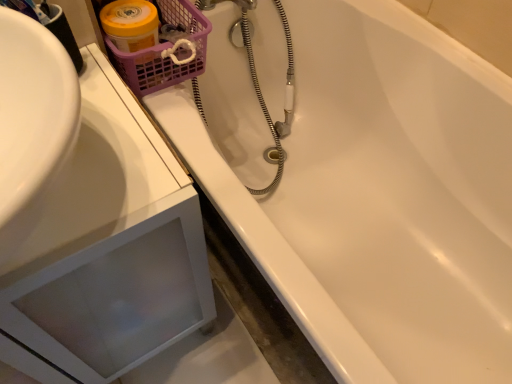
The width and height of the screenshot is (512, 384). What do you see at coordinates (160, 52) in the screenshot?
I see `purple plastic basket at upper left` at bounding box center [160, 52].

Measure the distance between point (x=154, y=84) and camera.

→ Point (x=154, y=84) is 86.60 centimeters away from camera.

Where is `purple plastic basket at upper left`? This screenshot has width=512, height=384. purple plastic basket at upper left is located at coordinates (160, 52).

In order to click on white glossy sink at upper left in this screenshot , I will do `click(106, 250)`.

What is the approximate height of white glossy sink at upper left?

26.62 inches.

What do you see at coordinates (106, 250) in the screenshot? I see `white glossy sink at upper left` at bounding box center [106, 250].

At what (x,y) coordinates should I click in order to perform the action: click on purple plastic basket at upper left. Please return your answer as a coordinate pair (x, y). The height and width of the screenshot is (384, 512). Looking at the image, I should click on (160, 52).

Is purple plastic basket at upper left at the right side of white glossy sink at upper left?

Yes.

Which object is further away from the camera, purple plastic basket at upper left or white glossy sink at upper left?

Positioned behind is purple plastic basket at upper left.

Does point (138, 81) come closer to viewer compared to point (90, 232)?

No, (138, 81) is behind (90, 232).

From the image's perspective, is purple plastic basket at upper left above white glossy sink at upper left?

Yes, from the image's perspective, purple plastic basket at upper left is above white glossy sink at upper left.

In the scene shown: From a real-world perspective, who is located lower, purple plastic basket at upper left or white glossy sink at upper left?

white glossy sink at upper left is physically lower.

Does purple plastic basket at upper left have a lesser width compared to white glossy sink at upper left?

Indeed, purple plastic basket at upper left has a lesser width compared to white glossy sink at upper left.

Considering the sizes of purple plastic basket at upper left and white glossy sink at upper left in the image, is purple plastic basket at upper left taller or shorter than white glossy sink at upper left?

Considering their sizes, purple plastic basket at upper left has less height than white glossy sink at upper left.

Considering the sizes of objects purple plastic basket at upper left and white glossy sink at upper left in the image provided, who is bigger, purple plastic basket at upper left or white glossy sink at upper left?

white glossy sink at upper left.

Is purple plastic basket at upper left located outside white glossy sink at upper left?

Yes, purple plastic basket at upper left is located beyond the bounds of white glossy sink at upper left.

Is the surface of purple plastic basket at upper left in direct contact with white glossy sink at upper left?

purple plastic basket at upper left and white glossy sink at upper left are clearly separated.

Is purple plastic basket at upper left turned away from white glossy sink at upper left?

No, purple plastic basket at upper left's orientation is not away from white glossy sink at upper left.

How far apart are purple plastic basket at upper left and white glossy sink at upper left?

purple plastic basket at upper left is 13.78 inches away from white glossy sink at upper left.

You are a GUI agent. You are given a task and a screenshot of the screen. Output one action in this format:
    pyautogui.click(x=<x>, y=<y>)
    Task: Click on the basket that appears above the white glossy sink at upper left (from a real-world perspective)
    
    Given the screenshot: What is the action you would take?
    pyautogui.click(x=160, y=52)

Would you say white glossy sink at upper left is to the left or to the right of purple plastic basket at upper left in the picture?

Clearly, white glossy sink at upper left is on the left of purple plastic basket at upper left in the image.

Does white glossy sink at upper left lie behind purple plastic basket at upper left?

No, it is not.

Is point (144, 211) behind point (203, 64)?

No.

From the image's perspective, which is below, white glossy sink at upper left or purple plastic basket at upper left?

white glossy sink at upper left.

From a real-world perspective, is white glossy sink at upper left beneath purple plastic basket at upper left?

Correct, in the physical world, white glossy sink at upper left is lower than purple plastic basket at upper left.

Considering the sizes of white glossy sink at upper left and purple plastic basket at upper left in the image, is white glossy sink at upper left wider or thinner than purple plastic basket at upper left?

In the image, white glossy sink at upper left appears to be wider than purple plastic basket at upper left.

Is white glossy sink at upper left taller than purple plastic basket at upper left?

Yes, white glossy sink at upper left is taller than purple plastic basket at upper left.

Between white glossy sink at upper left and purple plastic basket at upper left, which one has smaller size?

purple plastic basket at upper left.

Choose the correct answer: Is white glossy sink at upper left inside purple plastic basket at upper left or outside it?

white glossy sink at upper left is spatially situated outside purple plastic basket at upper left.

Is white glossy sink at upper left far away from purple plastic basket at upper left?

No, there isn't a large distance between white glossy sink at upper left and purple plastic basket at upper left.

Is white glossy sink at upper left facing towards purple plastic basket at upper left?

No, white glossy sink at upper left is not facing towards purple plastic basket at upper left.

Where is `basket that appears above the white glossy sink at upper left (from the image's perspective)`? basket that appears above the white glossy sink at upper left (from the image's perspective) is located at coordinates (160, 52).

This screenshot has height=384, width=512. Identify the location of basket located behind the white glossy sink at upper left. (160, 52).

Where is `basket that is above the white glossy sink at upper left (from a real-world perspective)`? basket that is above the white glossy sink at upper left (from a real-world perspective) is located at coordinates (160, 52).